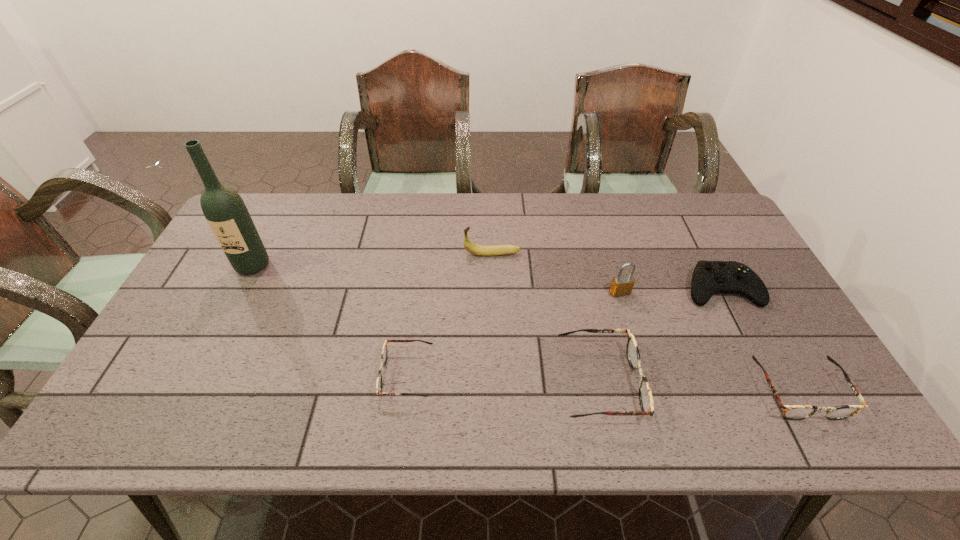
The image size is (960, 540). I want to click on spectacles that is positioned at the right edge, so click(x=790, y=412).

The height and width of the screenshot is (540, 960). Find the location of `control that is positioned at the right edge`. control that is positioned at the right edge is located at coordinates (709, 277).

Where is `object present at the near right corner`? The image size is (960, 540). object present at the near right corner is located at coordinates (790, 412).

This screenshot has height=540, width=960. In the image, there is a desktop. What are the coordinates of `vacant space at the far edge` in the screenshot? It's located at (482, 219).

This screenshot has height=540, width=960. In order to click on free space at the near edge of the desktop in this screenshot , I will do (x=622, y=382).

The image size is (960, 540). In the image, there is a desktop. Find the location of `blank space at the left edge`. blank space at the left edge is located at coordinates (210, 353).

At what (x,y) coordinates should I click in order to perform the action: click on vacant space at the right edge of the desktop. Please return your answer as a coordinate pair (x, y). The width and height of the screenshot is (960, 540). Looking at the image, I should click on (741, 309).

Identify the location of free point at the far left corner. (279, 222).

Where is `free space that is in between the shortest object and the banana`? This screenshot has height=540, width=960. free space that is in between the shortest object and the banana is located at coordinates (449, 314).

Image resolution: width=960 pixels, height=540 pixels. Identify the location of vacant space that is in between the padlock and the rightmost spectacles. (708, 342).